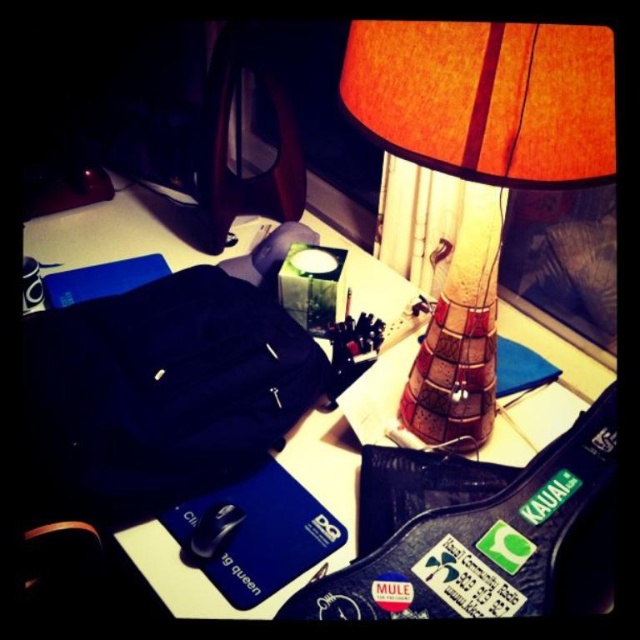
Question: Among these points, which one is farthest from the camera?

Choices:
 (A) (444, 339)
 (B) (372, 432)

Answer: (B)

Question: Is matte black backpack at center positioned in front of white paper at upper center?

Choices:
 (A) no
 (B) yes

Answer: (B)

Question: Estimate the real-world distances between objects in this image. Which object is closer to the white paper at upper center?

Choices:
 (A) orange fabric lampshade at upper right
 (B) matte black backpack at center

Answer: (B)

Question: Is orange fabric lampshade at upper right wider than white paper at upper center?

Choices:
 (A) no
 (B) yes

Answer: (A)

Question: Which of these objects is positioned closest to the orange fabric lampshade at upper right?

Choices:
 (A) matte black backpack at center
 (B) white paper at upper center

Answer: (B)

Question: Is orange fabric lampshade at upper right further to camera compared to white paper at upper center?

Choices:
 (A) no
 (B) yes

Answer: (A)